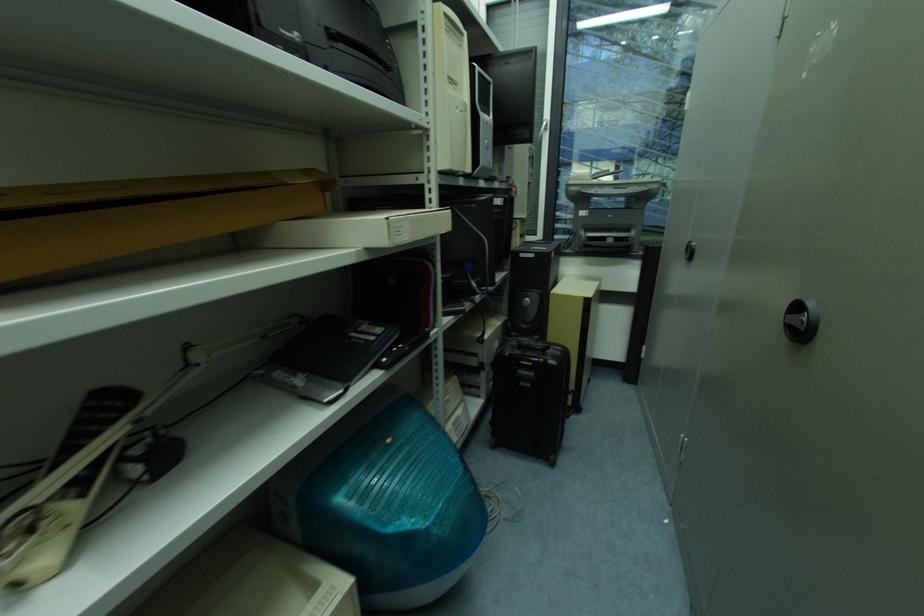
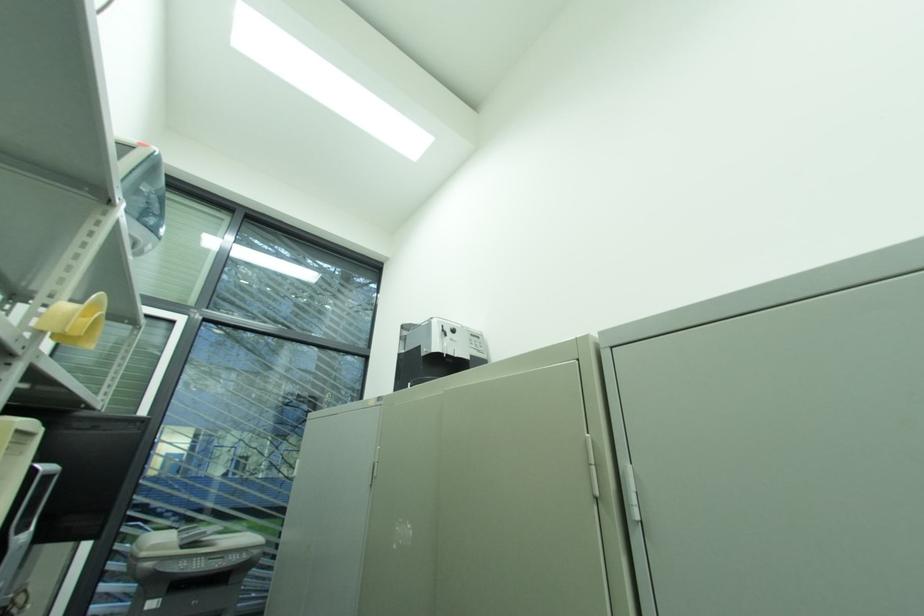
In the scene shown: The images are taken continuously from a first-person perspective. In which direction is your viewpoint rotating?

The camera's rotation is toward right-up.